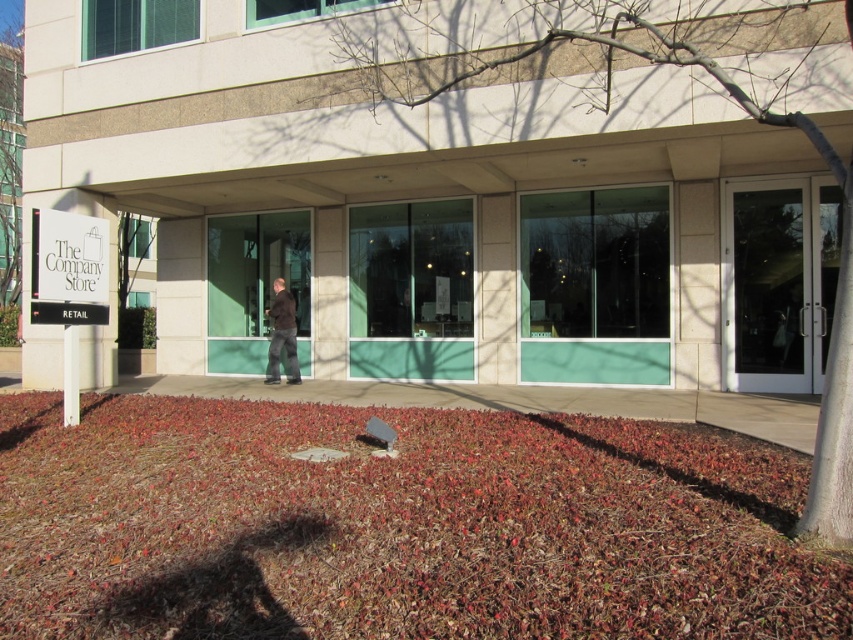
Between white glass door at right and white plastic sign at upper left, which one appears on the left side from the viewer's perspective?

white plastic sign at upper left is more to the left.

What do you see at coordinates (778, 282) in the screenshot?
I see `white glass door at right` at bounding box center [778, 282].

What do you see at coordinates (778, 282) in the screenshot? This screenshot has height=640, width=853. I see `white glass door at right` at bounding box center [778, 282].

In order to click on white glass door at right in this screenshot , I will do `click(778, 282)`.

Is point (830, 272) positioned in front of point (283, 337)?

Yes, it is in front of point (283, 337).

Locate an element on the screen. The width and height of the screenshot is (853, 640). white glass door at right is located at coordinates (778, 282).

The height and width of the screenshot is (640, 853). I want to click on white glass door at right, so click(x=778, y=282).

You are a GUI agent. You are given a task and a screenshot of the screen. Output one action in this format:
    pyautogui.click(x=<x>, y=<y>)
    Task: Click on the white glass door at right
    The height and width of the screenshot is (640, 853).
    Given the screenshot: What is the action you would take?
    pyautogui.click(x=778, y=282)

Who is more distant from viewer, (x=86, y=246) or (x=288, y=364)?

The point (x=288, y=364) is more distant.

Is white plastic sign at upper left shorter than dark brown jacket at center?

Indeed, white plastic sign at upper left has a lesser height compared to dark brown jacket at center.

In order to click on white plastic sign at upper left in this screenshot , I will do `click(68, 257)`.